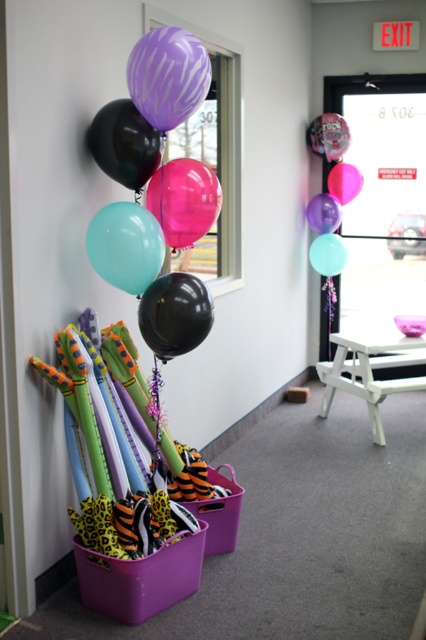
Question: Which is farther from the black glossy balloon at center?

Choices:
 (A) matte teal balloon at upper left
 (B) shiny metallic balloon at upper center
 (C) pink glossy balloon at upper center
 (D) purple zebra-patterned balloon at upper left

Answer: (B)

Question: Is purple zebra-patterned balloon at upper left to the left of matte teal balloon at upper left from the viewer's perspective?

Choices:
 (A) yes
 (B) no

Answer: (B)

Question: Can you confirm if black glossy balloon at center is bigger than translucent glossy balloon at center?

Choices:
 (A) no
 (B) yes

Answer: (A)

Question: Which object appears closest to the camera in this image?

Choices:
 (A) matte teal balloon at center
 (B) shiny metallic balloon at upper center
 (C) purple zebra-patterned balloon at upper left
 (D) black matte balloon at left

Answer: (C)

Question: Among these objects, which one is nearest to the camera?

Choices:
 (A) purple zebra-patterned balloon at upper left
 (B) shiny metallic balloon at upper center
 (C) white plastic stool at lower center
 (D) matte teal balloon at center

Answer: (A)

Question: Does purple zebra-patterned balloon at upper left appear on the left side of translucent purple balloon at upper center?

Choices:
 (A) yes
 (B) no

Answer: (A)